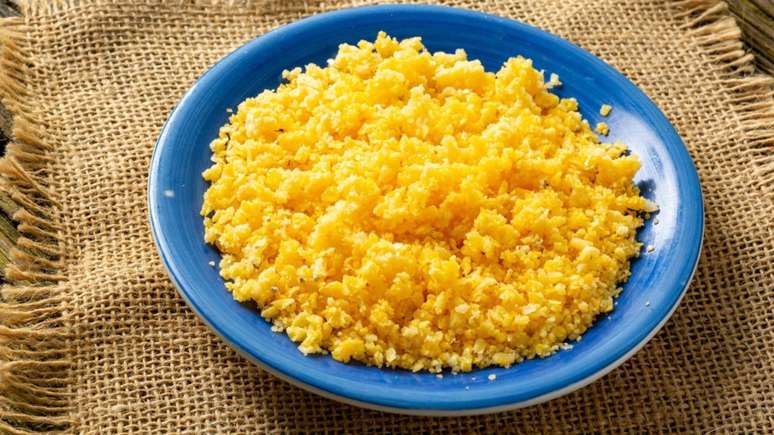
Identify the location of white part of bowl. This screenshot has height=435, width=774. (662, 325), (427, 412), (313, 391).